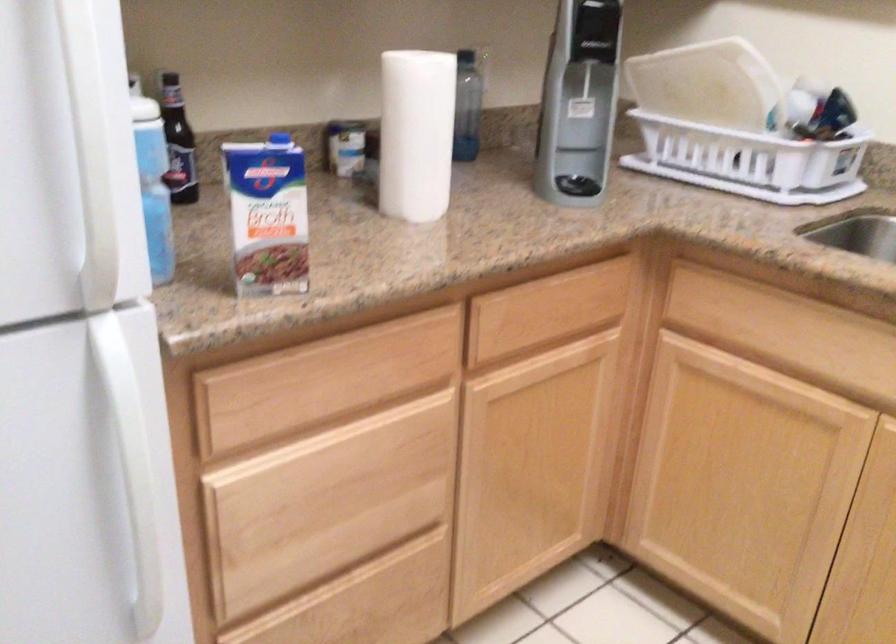
Question: The camera is either moving clockwise (left) or counter-clockwise (right) around the object. The first image is from the beginning of the video and the second image is from the end. Is the camera moving left or right when shooting the video?

Choices:
 (A) Left
 (B) Right

Answer: (B)